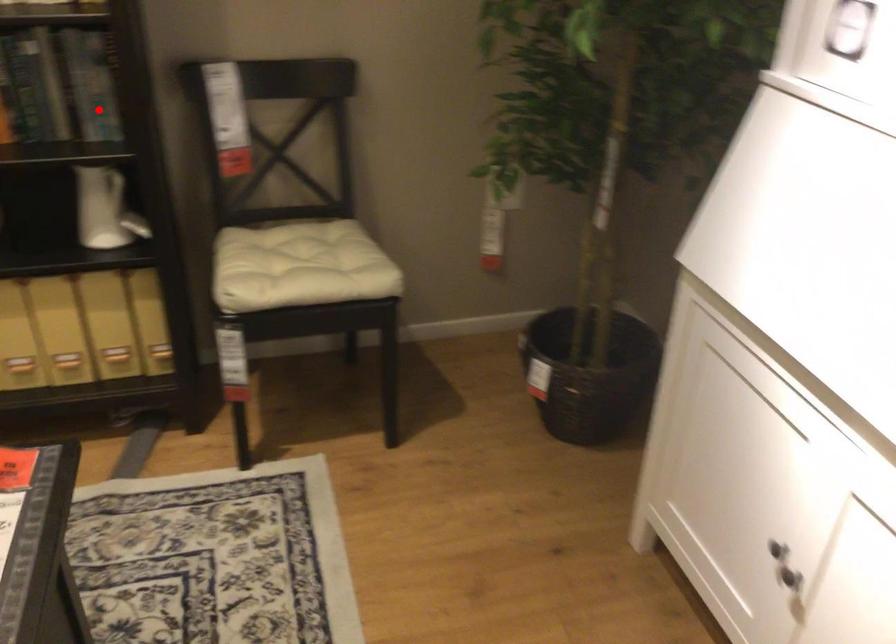
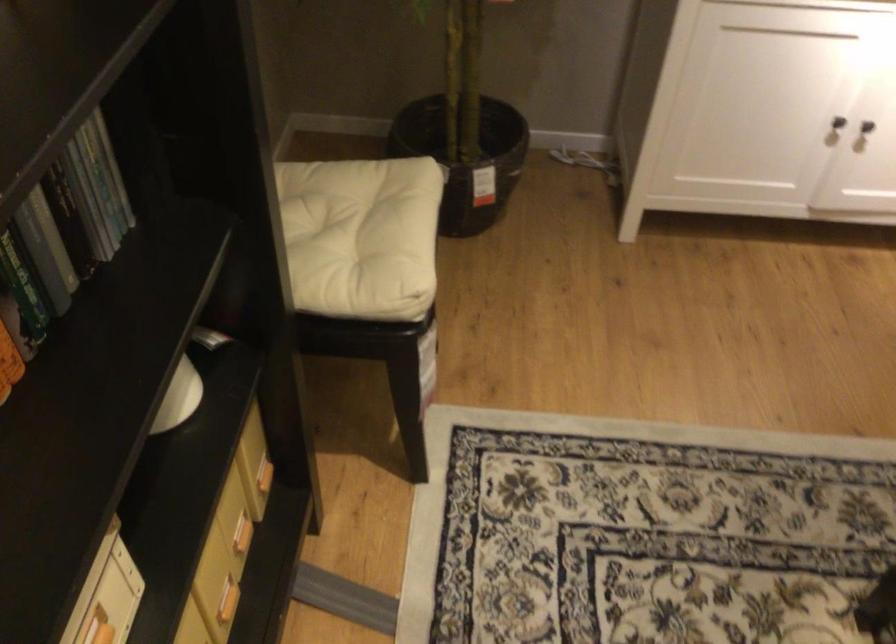
Question: I am providing you with two images of the same scene from different viewpoints. A red point is shown in image1. For the corresponding object point in image2, is it positioned nearer or farther from the camera?

Choices:
 (A) Nearer
 (B) Farther

Answer: (A)